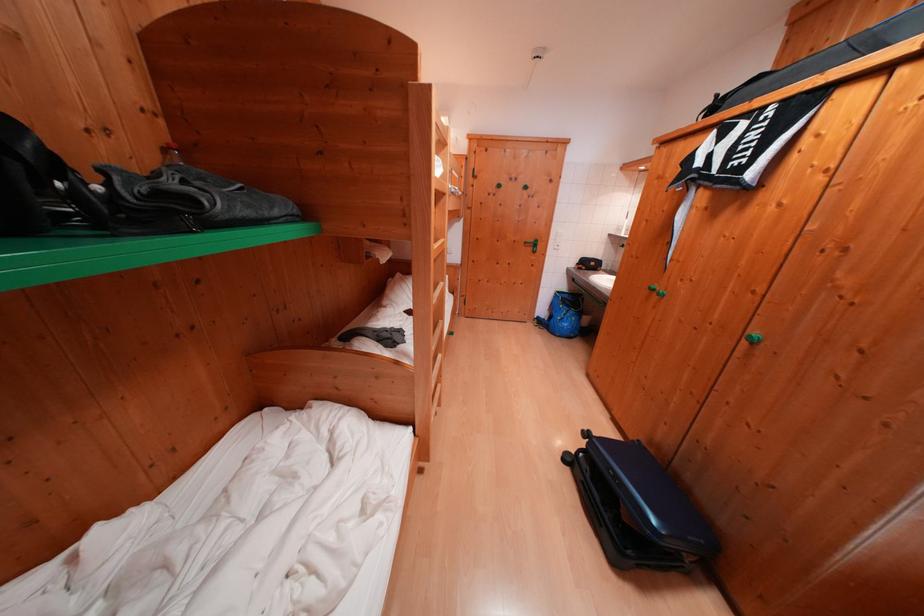
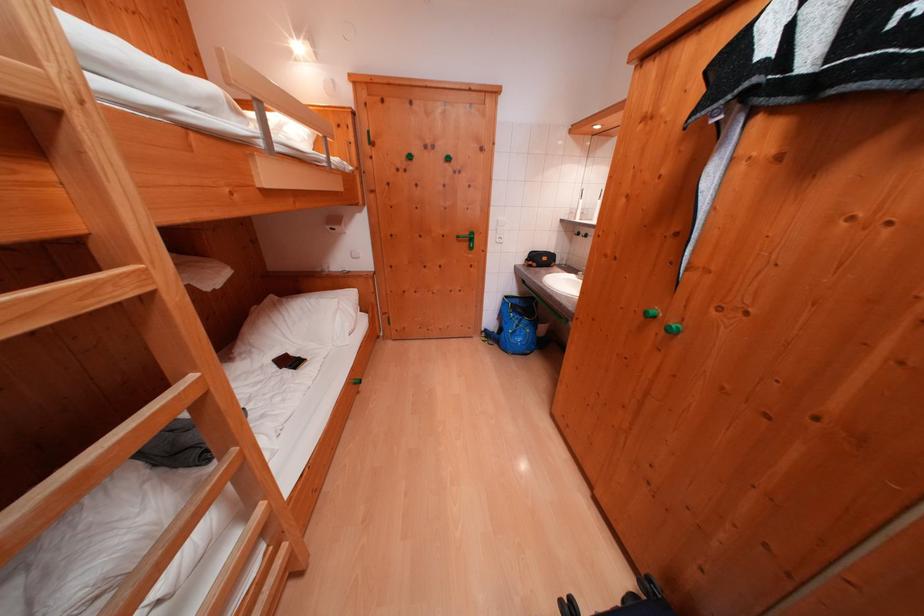
Locate, in the second image, the point that corresponds to the point at 533,246 in the first image.

(466, 241)